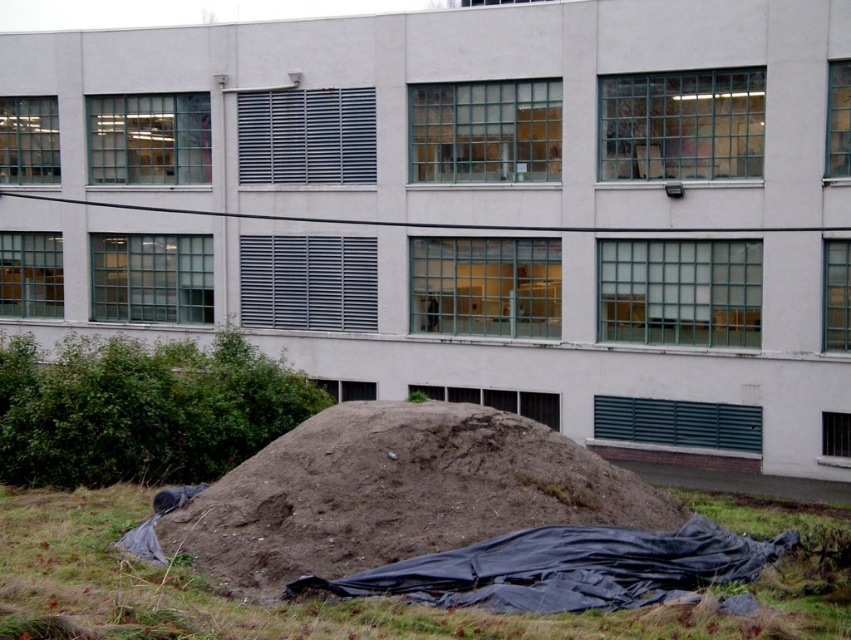
You are standing in front of the building and want to place a new rectangular sign that is 1.5 meters wide. The sign must be placed on the ground in front of the building, avoiding the brown dirt mound at lower center. Based on the coordinates provided, is there enough space to place the sign without overlapping the mound?

The brown dirt mound at lower center is located at coordinates (397,492). Since the sign is 1.5 meters wide and needs to be placed on the ground in front of the building, the exact placement would depend on the total available space. However, without additional information about the dimensions of the area in front of the building or the size of the mound, it is impossible to determine if there is enough space to place the sign without overlapping the mound.

Looking at this image, you are a construction worker who needs to place a heavy equipment on the ground in front of the building. The equipment requires a stable surface. Based on the image, which area between the brown dirt mound at lower center and the brown grass at lower center would be more suitable for placing the equipment?

The brown grass at lower center is more suitable because the brown dirt mound at lower center is located above it, which suggests the grass area is lower and potentially more stable for placing heavy equipment.